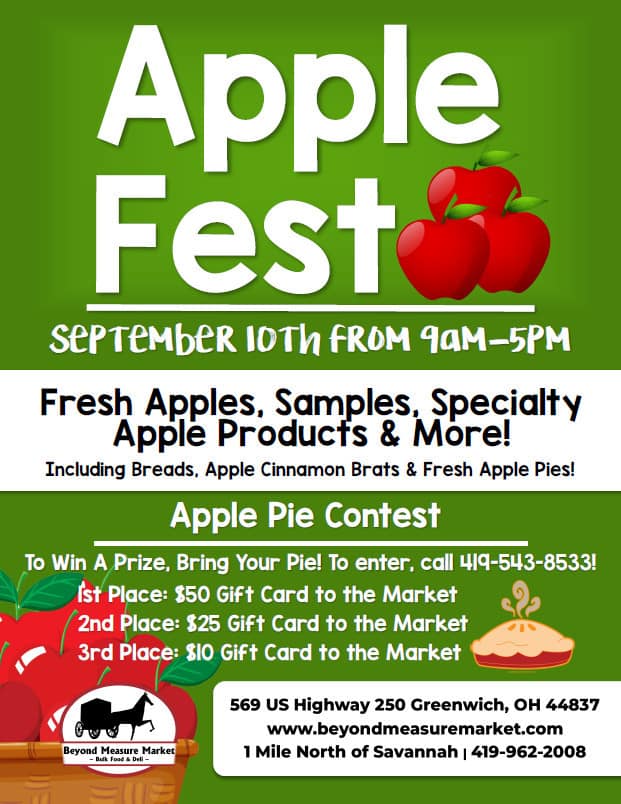
This screenshot has height=804, width=621. I want to click on basket, so click(40, 777).